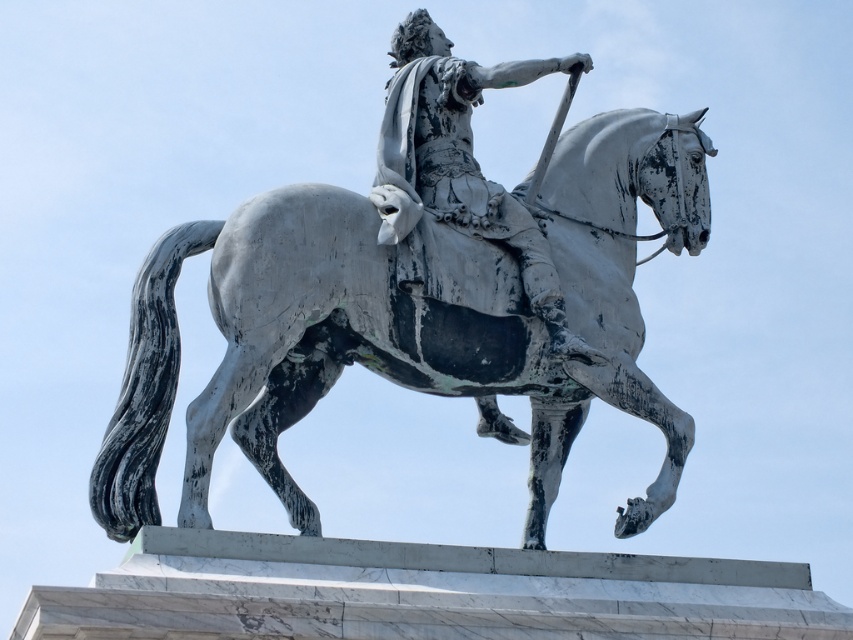
Question: Which object appears farthest from the camera in this image?

Choices:
 (A) bronze statue at center
 (B) white weathered horse at center

Answer: (A)

Question: Can you confirm if white weathered horse at center is smaller than bronze statue at center?

Choices:
 (A) no
 (B) yes

Answer: (A)

Question: From the image, what is the correct spatial relationship of white weathered horse at center in relation to bronze statue at center?

Choices:
 (A) below
 (B) above

Answer: (A)

Question: Observing the image, what is the correct spatial positioning of white weathered horse at center in reference to bronze statue at center?

Choices:
 (A) left
 (B) right

Answer: (B)

Question: Which point appears farthest from the camera in this image?

Choices:
 (A) (224, 307)
 (B) (398, 164)

Answer: (B)

Question: Which object appears closest to the camera in this image?

Choices:
 (A) white weathered horse at center
 (B) bronze statue at center

Answer: (A)